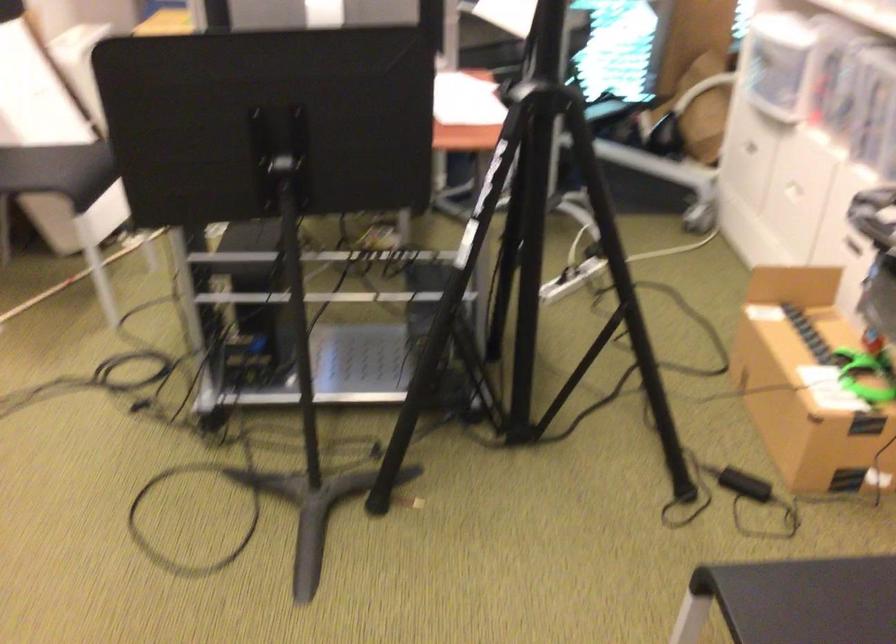
This screenshot has width=896, height=644. Describe the element at coordinates (842, 597) in the screenshot. I see `a black chair sitting surface` at that location.